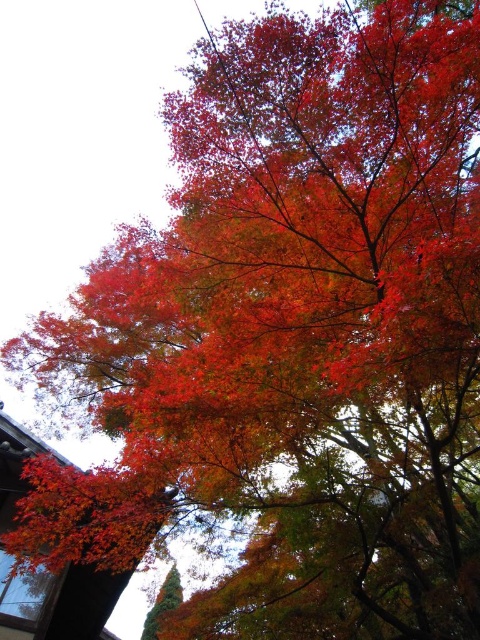
Question: Can you confirm if shiny red maple leaf at lower left is bigger than shiny green pine tree at lower left?

Choices:
 (A) yes
 (B) no

Answer: (B)

Question: Is shiny red maple leaf at lower left below shiny green pine tree at lower left?

Choices:
 (A) yes
 (B) no

Answer: (B)

Question: From the image, what is the correct spatial relationship of shiny red maple leaf at lower left in relation to shiny green pine tree at lower left?

Choices:
 (A) right
 (B) left

Answer: (B)

Question: Which point is farther to the camera?

Choices:
 (A) shiny red maple leaf at lower left
 (B) shiny green pine tree at lower left

Answer: (B)